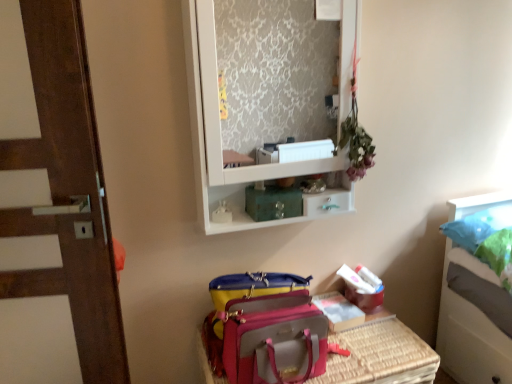
Question: Can you confirm if pink fabric suitcase at lower center is smaller than white glossy medicine cabinet at upper center?

Choices:
 (A) yes
 (B) no

Answer: (B)

Question: Considering the relative sizes of pink fabric suitcase at lower center and white glossy medicine cabinet at upper center in the image provided, is pink fabric suitcase at lower center taller than white glossy medicine cabinet at upper center?

Choices:
 (A) no
 (B) yes

Answer: (A)

Question: Considering the relative sizes of pink fabric suitcase at lower center and white glossy medicine cabinet at upper center in the image provided, is pink fabric suitcase at lower center thinner than white glossy medicine cabinet at upper center?

Choices:
 (A) no
 (B) yes

Answer: (A)

Question: Considering the relative sizes of pink fabric suitcase at lower center and white glossy medicine cabinet at upper center in the image provided, is pink fabric suitcase at lower center wider than white glossy medicine cabinet at upper center?

Choices:
 (A) yes
 (B) no

Answer: (A)

Question: From the image's perspective, is pink fabric suitcase at lower center above white glossy medicine cabinet at upper center?

Choices:
 (A) no
 (B) yes

Answer: (A)

Question: From a real-world perspective, does pink fabric suitcase at lower center sit lower than white glossy medicine cabinet at upper center?

Choices:
 (A) yes
 (B) no

Answer: (A)

Question: Could you tell me if white glossy medicine cabinet at upper center is facing pink fabric suitcase at lower center?

Choices:
 (A) yes
 (B) no

Answer: (B)

Question: Does white glossy medicine cabinet at upper center have a larger size compared to pink fabric suitcase at lower center?

Choices:
 (A) yes
 (B) no

Answer: (B)

Question: Does white glossy medicine cabinet at upper center have a smaller size compared to pink fabric suitcase at lower center?

Choices:
 (A) no
 (B) yes

Answer: (B)

Question: Considering the relative positions of white glossy medicine cabinet at upper center and pink fabric suitcase at lower center in the image provided, is white glossy medicine cabinet at upper center to the right of pink fabric suitcase at lower center from the viewer's perspective?

Choices:
 (A) no
 (B) yes

Answer: (A)

Question: Is white glossy medicine cabinet at upper center wider than pink fabric suitcase at lower center?

Choices:
 (A) no
 (B) yes

Answer: (A)

Question: From a real-world perspective, is white glossy medicine cabinet at upper center physically below pink fabric suitcase at lower center?

Choices:
 (A) yes
 (B) no

Answer: (B)

Question: Is metallic teal drawer at upper center outside white glossy medicine cabinet at upper center?

Choices:
 (A) yes
 (B) no

Answer: (B)